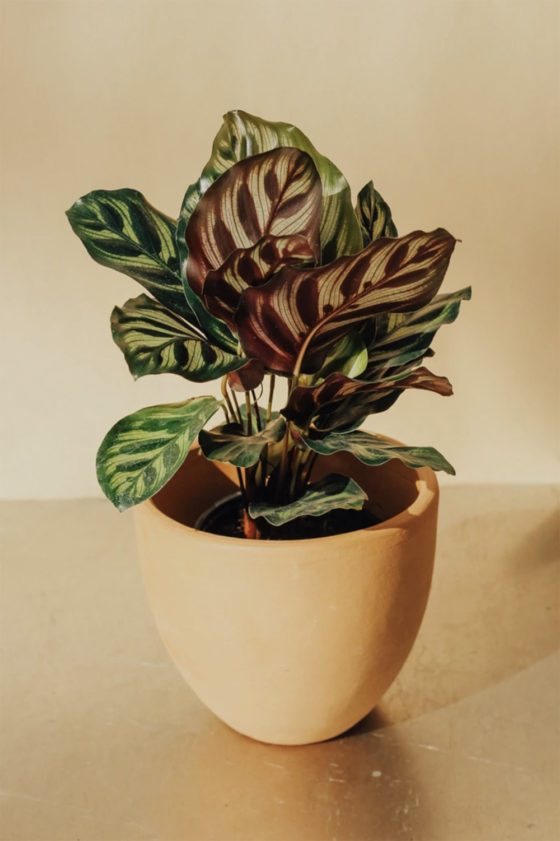
Where is `wall`? The image size is (560, 841). wall is located at coordinates (396, 96).